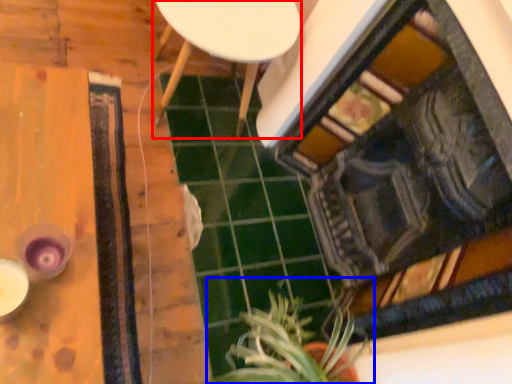
Question: Which object is closer to the camera taking this photo, furniture (highlighted by a red box) or houseplant (highlighted by a blue box)?

Choices:
 (A) furniture
 (B) houseplant

Answer: (B)